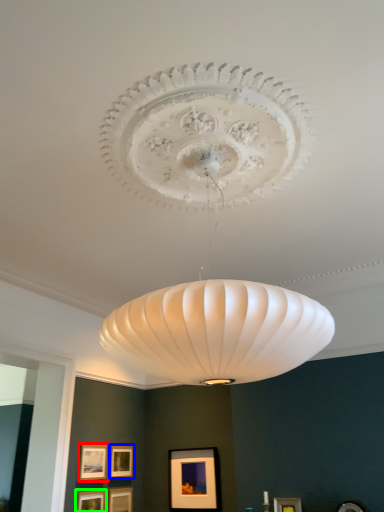
Question: Considering the real-world distances, which object is closest to picture frame (highlighted by a red box)? picture frame (highlighted by a blue box) or picture frame (highlighted by a green box).

Choices:
 (A) picture frame
 (B) picture frame

Answer: (A)